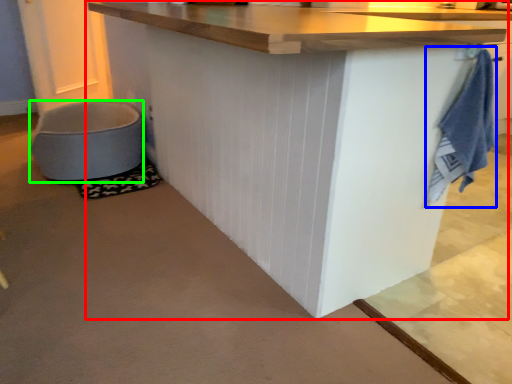
Question: Estimate the real-world distances between objects in this image. Which object is farther from table (highlighted by a red box), bath towel (highlighted by a blue box) or toilet bowl (highlighted by a green box)?

Choices:
 (A) bath towel
 (B) toilet bowl

Answer: (B)